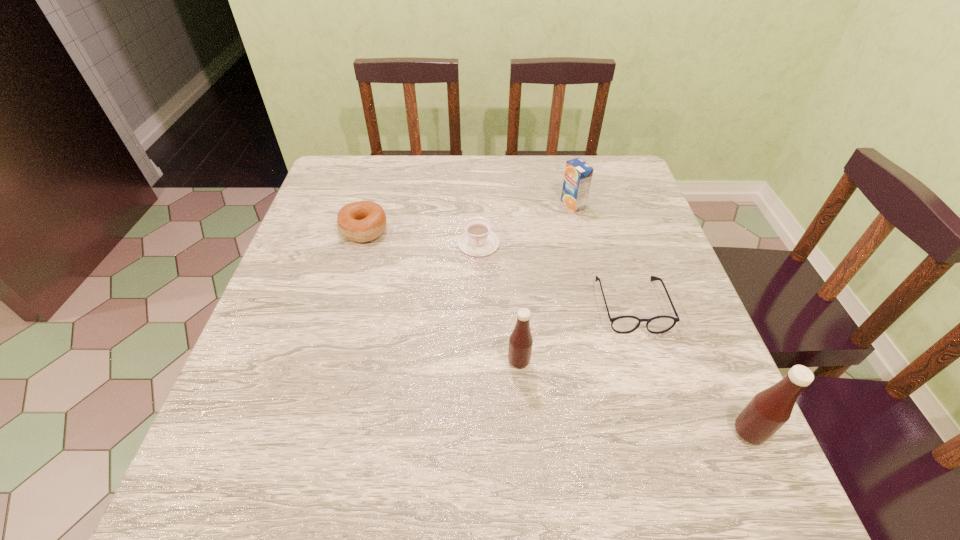
You are a GUI agent. You are given a task and a screenshot of the screen. Output one action in this format:
    pyautogui.click(x=<x>, y=<y>)
    Task: Click on the object at the near right corner
    
    Given the screenshot: What is the action you would take?
    pyautogui.click(x=770, y=409)

The image size is (960, 540). In the image, there is a desktop. What are the coordinates of `vacant space at the far edge` in the screenshot? It's located at (507, 157).

You are a GUI agent. You are given a task and a screenshot of the screen. Output one action in this format:
    pyautogui.click(x=<x>, y=<y>)
    Task: Click on the vacant space at the left edge
    Image resolution: width=960 pixels, height=540 pixels.
    Given the screenshot: What is the action you would take?
    pyautogui.click(x=325, y=370)

Locate an element on the screen. The height and width of the screenshot is (540, 960). free spot at the right edge of the desktop is located at coordinates (593, 213).

In the image, there is a desktop. Identify the location of free region at the far left corner. (340, 178).

Where is `vacant space at the near left corner of the desktop`? vacant space at the near left corner of the desktop is located at coordinates (246, 400).

Where is `free spot between the fifth object from right to left and the third tallest object`? free spot between the fifth object from right to left and the third tallest object is located at coordinates (526, 224).

Locate an element on the screen. Image resolution: width=960 pixels, height=540 pixels. empty space between the nearer Tabasco sauce and the fourth object from right to left is located at coordinates (634, 397).

The image size is (960, 540). I want to click on vacant space that is in between the farther Tabasco sauce and the nearest object, so click(634, 397).

Where is `free area in between the taller Tabasco sauce and the teacup`? free area in between the taller Tabasco sauce and the teacup is located at coordinates point(613,338).